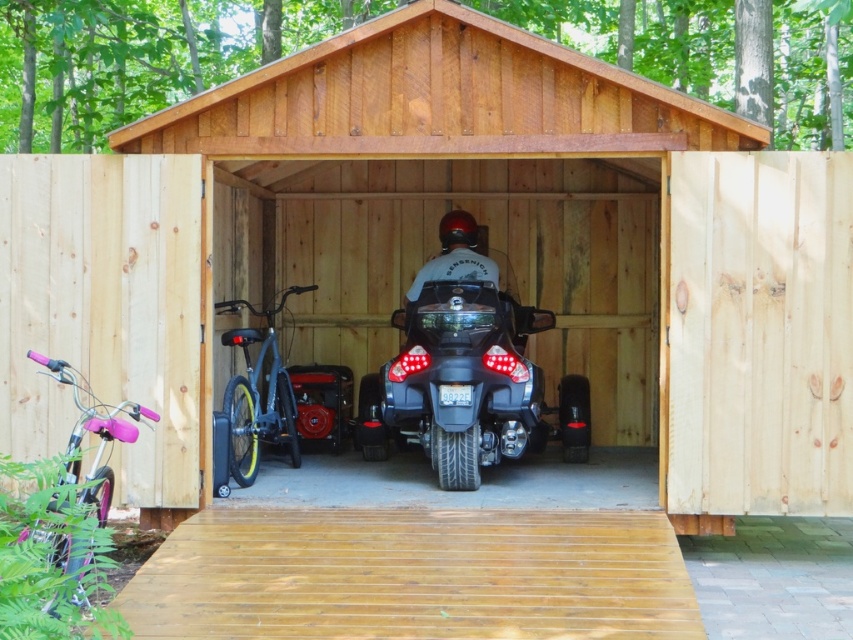
You are planning to store a new item in the shed and need to ensure there is enough vertical clearance between the black matte trike at center and the pink metallic bicycle at lower left. Which vehicle requires more vertical space due to its height?

The black matte trike at center requires more vertical space because it has a greater height compared to the pink metallic bicycle at lower left.

You are standing in front of the wooden shed and looking at the two points marked in the image. Which point, point (819, 179) or point (462, 468), is closer to your eyes?

Point (819, 179) is closer to your eyes because it is closer to the camera than point (462, 468).